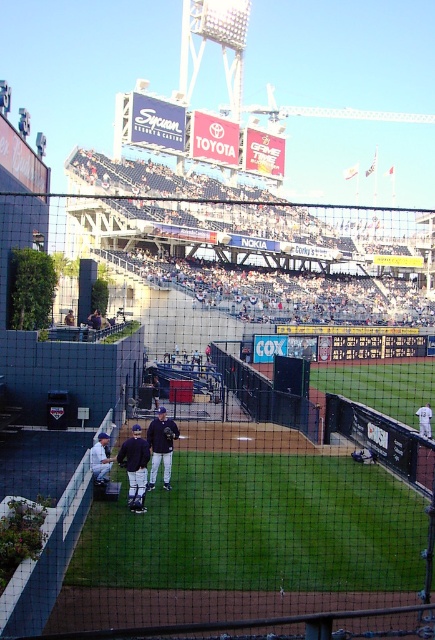
Who is more distant from viewer, [412,493] or [217,216]?

The point [217,216] is more distant.

What do you see at coordinates (260, 529) in the screenshot? This screenshot has width=435, height=640. I see `green grass field at lower center` at bounding box center [260, 529].

I want to click on green grass field at lower center, so click(260, 529).

Locate an element on the screen. green grass field at lower center is located at coordinates (260, 529).

Is green grass field at lower center behind black leather baseball glove at center?

No, it is not.

Can you confirm if green grass field at lower center is shorter than black leather baseball glove at center?

In fact, green grass field at lower center may be taller than black leather baseball glove at center.

Identify the location of green grass field at lower center. The image size is (435, 640). (260, 529).

Between point (253, 310) and point (127, 472), which one is positioned in front?

Point (127, 472) is more forward.

Is white uniformed players at center thinner than dark blue uniform at center?

No, white uniformed players at center is not thinner than dark blue uniform at center.

Describe the element at coordinates (260, 241) in the screenshot. This screenshot has height=640, width=435. I see `white uniformed players at center` at that location.

You are a GUI agent. You are given a task and a screenshot of the screen. Output one action in this format:
    pyautogui.click(x=<x>, y=<y>)
    Task: Click on the white uniformed players at center
    The height and width of the screenshot is (640, 435).
    Given the screenshot: What is the action you would take?
    pyautogui.click(x=260, y=241)